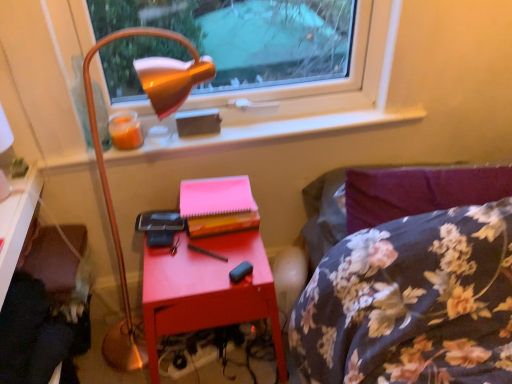
Question: Is velvet purple swivel chair at lower left positioned before pink paper at center?

Choices:
 (A) yes
 (B) no

Answer: (A)

Question: Does velvet purple swivel chair at lower left have a greater height compared to pink paper at center?

Choices:
 (A) yes
 (B) no

Answer: (A)

Question: Can you confirm if velvet purple swivel chair at lower left is smaller than pink paper at center?

Choices:
 (A) yes
 (B) no

Answer: (B)

Question: From a real-world perspective, does velvet purple swivel chair at lower left stand above pink paper at center?

Choices:
 (A) no
 (B) yes

Answer: (A)

Question: Does velvet purple swivel chair at lower left appear on the right side of pink paper at center?

Choices:
 (A) yes
 (B) no

Answer: (B)

Question: In terms of height, does metallic gold lamp at upper left look taller or shorter compared to matte wood desk at lower left?

Choices:
 (A) short
 (B) tall

Answer: (B)

Question: Is metallic gold lamp at upper left bigger or smaller than matte wood desk at lower left?

Choices:
 (A) big
 (B) small

Answer: (A)

Question: From a real-world perspective, is metallic gold lamp at upper left positioned above or below matte wood desk at lower left?

Choices:
 (A) below
 (B) above

Answer: (A)

Question: Is point [x=96, y=135] positioned closer to the camera than point [x=13, y=233]?

Choices:
 (A) closer
 (B) farther

Answer: (B)

Question: Considering the relative positions of metallic gold lamp at upper left and pink paper at center in the image provided, is metallic gold lamp at upper left to the left or to the right of pink paper at center?

Choices:
 (A) left
 (B) right

Answer: (A)

Question: Is metallic gold lamp at upper left taller or shorter than pink paper at center?

Choices:
 (A) short
 (B) tall

Answer: (B)

Question: Is point (138, 66) positioned closer to the camera than point (234, 200)?

Choices:
 (A) closer
 (B) farther

Answer: (A)

Question: In the image, is metallic gold lamp at upper left positioned in front of or behind pink paper at center?

Choices:
 (A) front
 (B) behind

Answer: (A)

Question: In the image, is matte red nightstand at center positioned in front of or behind matte wood desk at lower left?

Choices:
 (A) front
 (B) behind

Answer: (B)

Question: From a real-world perspective, is matte red nightstand at center above or below matte wood desk at lower left?

Choices:
 (A) above
 (B) below

Answer: (B)